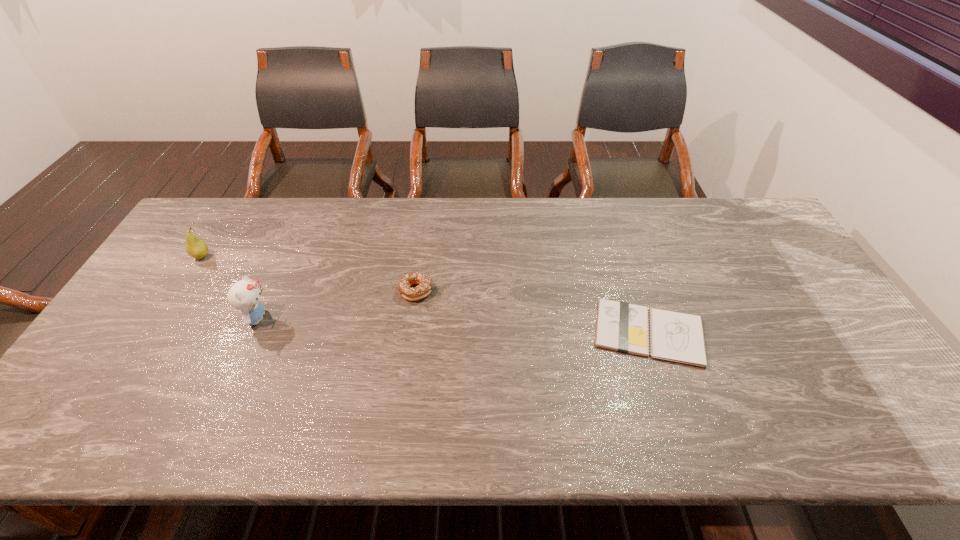
This screenshot has width=960, height=540. I want to click on kitten, so 244,295.

Where is `pear`? This screenshot has width=960, height=540. pear is located at coordinates (196, 248).

The height and width of the screenshot is (540, 960). What are the coordinates of `the farthest object` in the screenshot? It's located at (196, 248).

The width and height of the screenshot is (960, 540). Find the location of `doughnut`. doughnut is located at coordinates (424, 288).

Identify the location of the second shortest object. (424, 288).

The image size is (960, 540). I want to click on the shortest object, so (623, 327).

I want to click on notepad, so click(623, 327).

Locate an element on the screen. The height and width of the screenshot is (540, 960). vacant space located 0.250m on the front-facing side of the second object from left to right is located at coordinates [363, 318].

At what (x,y) coordinates should I click in order to perform the action: click on vacant space situated on the right of the pear. Please return your answer as a coordinate pair (x, y). Looking at the image, I should click on (276, 256).

Image resolution: width=960 pixels, height=540 pixels. What are the coordinates of `vacant area situated 0.270m on the front of the third object from left to right` in the screenshot? It's located at (403, 390).